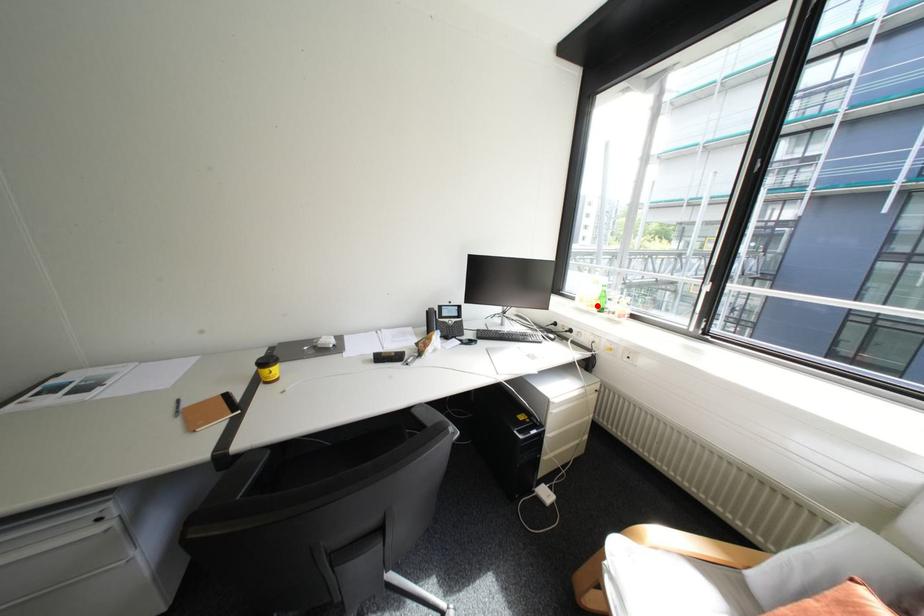
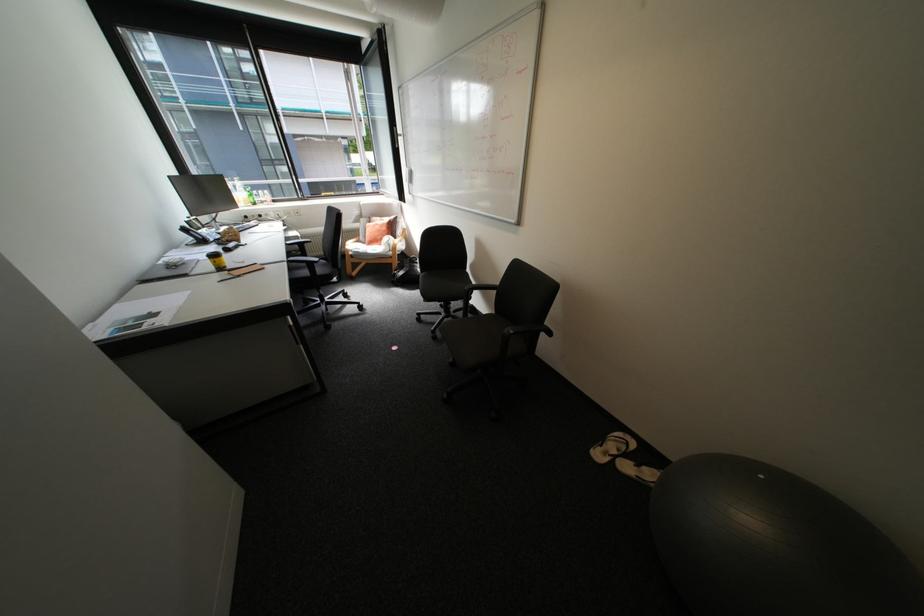
Question: I am providing you with two images of the same scene from different viewpoints. A red point is shown in image1. For the corresponding object point in image2, is it positioned nearer or farther from the camera?

Choices:
 (A) Nearer
 (B) Farther

Answer: (A)